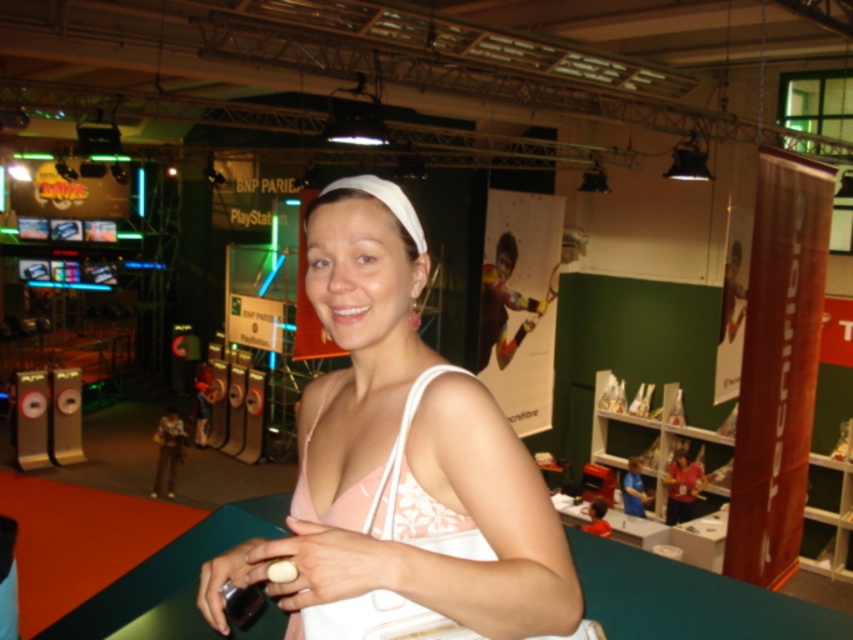
In the scene shown: Does white fabric purse at center appear on the right side of pink fabric dress at center?

Incorrect, white fabric purse at center is not on the right side of pink fabric dress at center.

Can you confirm if white fabric purse at center is smaller than pink fabric dress at center?

Actually, white fabric purse at center might be larger than pink fabric dress at center.

This screenshot has height=640, width=853. What do you see at coordinates (402, 456) in the screenshot?
I see `white fabric purse at center` at bounding box center [402, 456].

Locate an element on the screen. This screenshot has width=853, height=640. white fabric purse at center is located at coordinates (402, 456).